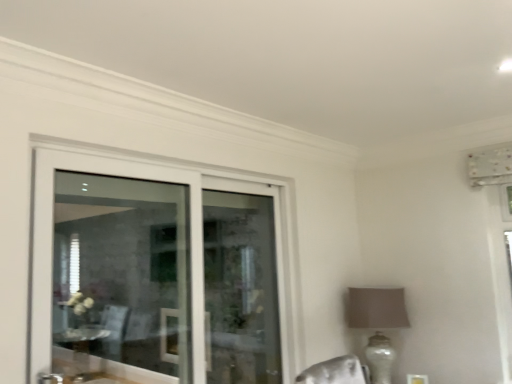
Identify the location of matte beige lampshade at right. The height and width of the screenshot is (384, 512). (377, 308).

Image resolution: width=512 pixels, height=384 pixels. What do you see at coordinates (377, 308) in the screenshot?
I see `matte beige lampshade at right` at bounding box center [377, 308].

From the picture: Measure the distance between clear glass door at upper left and camera.

A distance of 1.69 meters exists between clear glass door at upper left and camera.

This screenshot has width=512, height=384. What do you see at coordinates (154, 274) in the screenshot?
I see `clear glass door at upper left` at bounding box center [154, 274].

In order to click on clear glass door at upper left in this screenshot , I will do `click(154, 274)`.

What is the approximate width of clear glass door at upper left?

It is 2.42 inches.

Locate an element on the screen. This screenshot has width=512, height=384. matte beige lampshade at right is located at coordinates (377, 308).

Considering the relative positions of clear glass door at upper left and matte beige lampshade at right in the image provided, is clear glass door at upper left to the left of matte beige lampshade at right from the viewer's perspective?

Indeed, clear glass door at upper left is positioned on the left side of matte beige lampshade at right.

In the image, is clear glass door at upper left positioned in front of or behind matte beige lampshade at right?

clear glass door at upper left is positioned closer to the viewer than matte beige lampshade at right.

Does point (159, 346) come farther from viewer compared to point (373, 362)?

No, it is in front of (373, 362).

From the image's perspective, who appears lower, clear glass door at upper left or matte beige lampshade at right?

matte beige lampshade at right appears lower in the image.

From a real-world perspective, is clear glass door at upper left above or below matte beige lampshade at right?

In terms of real-world spatial position, clear glass door at upper left is above matte beige lampshade at right.

In the scene shown: Which of these two, clear glass door at upper left or matte beige lampshade at right, is wider?

matte beige lampshade at right is wider.

From their relative heights in the image, would you say clear glass door at upper left is taller or shorter than matte beige lampshade at right?

A: Clearly, clear glass door at upper left is taller compared to matte beige lampshade at right.

Considering the relative sizes of clear glass door at upper left and matte beige lampshade at right in the image provided, is clear glass door at upper left smaller than matte beige lampshade at right?

No, clear glass door at upper left is not smaller than matte beige lampshade at right.

Is clear glass door at upper left inside the boundaries of matte beige lampshade at right, or outside?

clear glass door at upper left is not enclosed by matte beige lampshade at right.

Is clear glass door at upper left far from matte beige lampshade at right?

Indeed, clear glass door at upper left is not near matte beige lampshade at right.

From the picture: Is clear glass door at upper left facing towards matte beige lampshade at right?

No, clear glass door at upper left is not oriented towards matte beige lampshade at right.

What's the angular difference between clear glass door at upper left and matte beige lampshade at right's facing directions?

The facing directions of clear glass door at upper left and matte beige lampshade at right are 90.1 degrees apart.

The image size is (512, 384). What are the coordinates of `door on the left of matte beige lampshade at right` in the screenshot? It's located at (154, 274).

Considering the positions of objects matte beige lampshade at right and clear glass door at upper left in the image provided, who is more to the right, matte beige lampshade at right or clear glass door at upper left?

Positioned to the right is matte beige lampshade at right.

Relative to clear glass door at upper left, is matte beige lampshade at right in front or behind?

matte beige lampshade at right is behind clear glass door at upper left.

Which is less distant, (376,346) or (115,217)?

Point (376,346) is closer to the camera than point (115,217).

From the image's perspective, is matte beige lampshade at right on clear glass door at upper left?

No, from the image's perspective, matte beige lampshade at right is not on top of clear glass door at upper left.

From a real-world perspective, is matte beige lampshade at right over clear glass door at upper left?

No, from a real-world perspective, matte beige lampshade at right is not on top of clear glass door at upper left.

Which of these two, matte beige lampshade at right or clear glass door at upper left, is thinner?

clear glass door at upper left.

Considering the relative sizes of matte beige lampshade at right and clear glass door at upper left in the image provided, is matte beige lampshade at right shorter than clear glass door at upper left?

Yes, matte beige lampshade at right is shorter than clear glass door at upper left.

Looking at the image, does matte beige lampshade at right seem bigger or smaller compared to clear glass door at upper left?

Considering their sizes, matte beige lampshade at right takes up less space than clear glass door at upper left.

Is matte beige lampshade at right outside of clear glass door at upper left?

Yes, matte beige lampshade at right is located beyond the bounds of clear glass door at upper left.

Is matte beige lampshade at right not near clear glass door at upper left?

matte beige lampshade at right is far away from clear glass door at upper left.

Could you tell me if matte beige lampshade at right is turned towards clear glass door at upper left?

Yes, matte beige lampshade at right is oriented towards clear glass door at upper left.

How many degrees apart are the facing directions of matte beige lampshade at right and clear glass door at upper left?

The angular difference between matte beige lampshade at right and clear glass door at upper left is 90.1 degrees.

Measure the distance between matte beige lampshade at right and clear glass door at upper left.

A distance of 3.64 feet exists between matte beige lampshade at right and clear glass door at upper left.

This screenshot has width=512, height=384. I want to click on table lamp on the right of the clear glass door at upper left, so click(377, 308).

Find the location of a particular element. door above the matte beige lampshade at right (from the image's perspective) is located at coordinates (154, 274).

This screenshot has width=512, height=384. In order to click on door above the matte beige lampshade at right (from a real-world perspective) in this screenshot , I will do `click(154, 274)`.